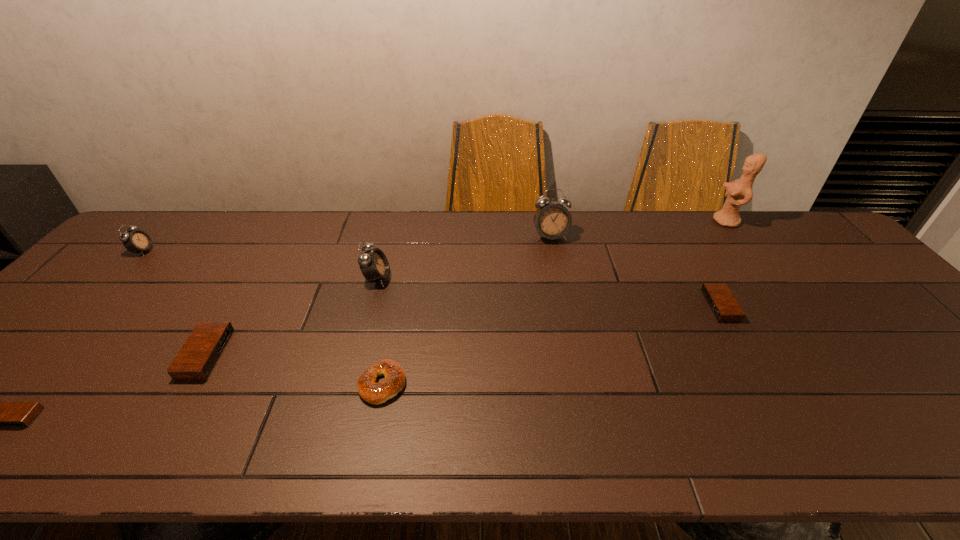
You are a GUI agent. You are given a task and a screenshot of the screen. Output one action in this format:
    pyautogui.click(x=<x>, y=<y>)
    Task: Click on the vacant space at the right edge of the desktop
    The height and width of the screenshot is (540, 960).
    Given the screenshot: What is the action you would take?
    pyautogui.click(x=834, y=278)

Find the location of a particular element. The image size is (960, 540). vacant area at the far left corner of the desktop is located at coordinates (159, 240).

Image resolution: width=960 pixels, height=540 pixels. I want to click on free space at the far right corner of the desktop, so click(x=775, y=212).

The height and width of the screenshot is (540, 960). I want to click on free space between the fourth tallest object and the fifth shortest alarm clock, so click(260, 265).

Find the location of a particular element. free spot between the tan bagel and the leftmost white alarm clock is located at coordinates (263, 318).

Image resolution: width=960 pixels, height=540 pixels. I want to click on empty space between the sixth object from right to left and the figurine, so click(x=467, y=288).

This screenshot has width=960, height=540. I want to click on empty space between the sixth object from left to right and the third object from left to right, so click(378, 295).

At what (x,y) coordinates should I click in order to perform the action: click on free spot between the second smallest black alarm clock and the fourth tallest alarm clock. Please return your answer as a coordinate pair (x, y). Looking at the image, I should click on (463, 330).

Identify the location of object identified as the sixth closest to the tallest object. Image resolution: width=960 pixels, height=540 pixels. (136, 240).

Identify which object is the fourth nearest to the farthest black alarm clock. Please provide its 2D coordinates. Your answer should be formatted as a tuple, i.e. [(x, y)], where the tuple contains the x and y coordinates of a point satisfying the conditions above.

[(373, 263)]